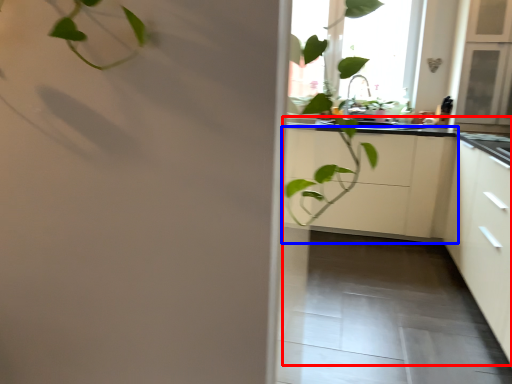
Question: Which object appears closest to the camera in this image, counter top (highlighted by a red box) or cabinetry (highlighted by a blue box)?

Choices:
 (A) counter top
 (B) cabinetry

Answer: (A)